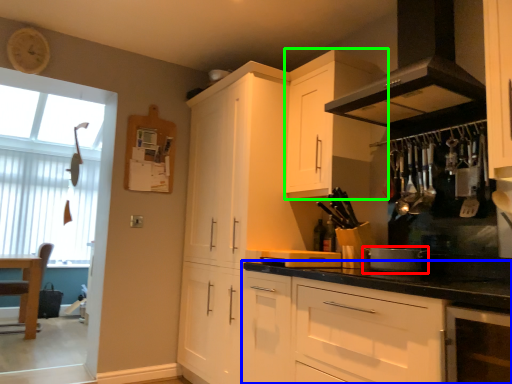
Question: Which object is positioned farthest from appliance (highlighted by a red box)? Select from cabinetry (highlighted by a blue box) and cabinetry (highlighted by a green box).

Choices:
 (A) cabinetry
 (B) cabinetry

Answer: (B)